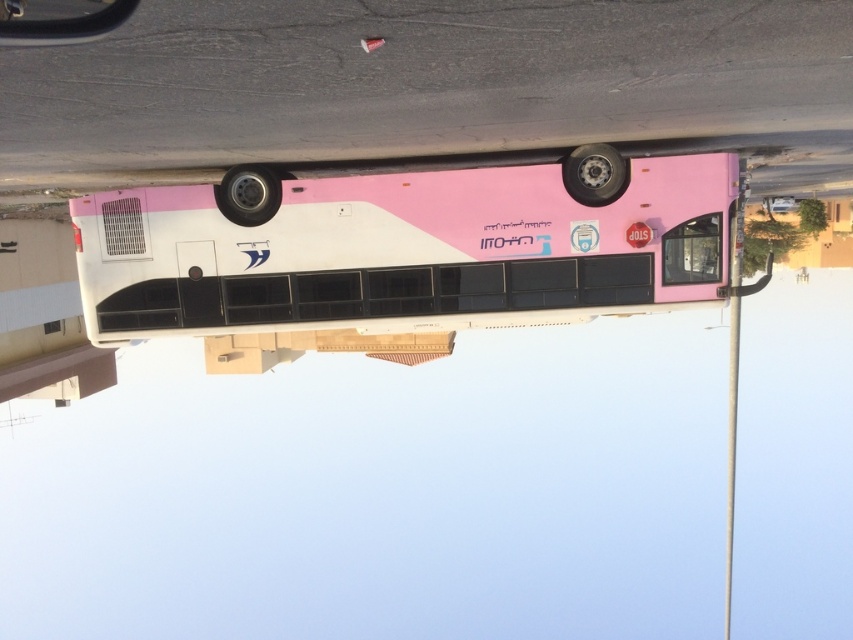
Question: Can you confirm if pink matte bus at center is smaller than metallic black view mirror at upper left?

Choices:
 (A) no
 (B) yes

Answer: (A)

Question: Which of the following is the closest to the observer?

Choices:
 (A) pink matte bus at center
 (B) metallic black view mirror at upper left

Answer: (B)

Question: Is pink matte bus at center to the left of metallic black view mirror at upper left from the viewer's perspective?

Choices:
 (A) yes
 (B) no

Answer: (B)

Question: Can you confirm if pink matte bus at center is bigger than metallic black view mirror at upper left?

Choices:
 (A) no
 (B) yes

Answer: (B)

Question: Which object is closer to the camera taking this photo?

Choices:
 (A) metallic black view mirror at upper left
 (B) pink matte bus at center

Answer: (A)